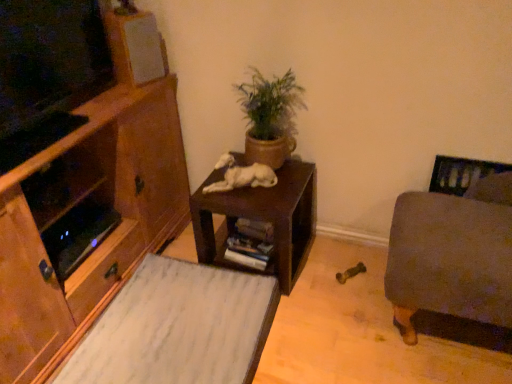
This screenshot has width=512, height=384. What are the coordinates of `free space to the right of dark brown wood table at center` in the screenshot? It's located at (337, 268).